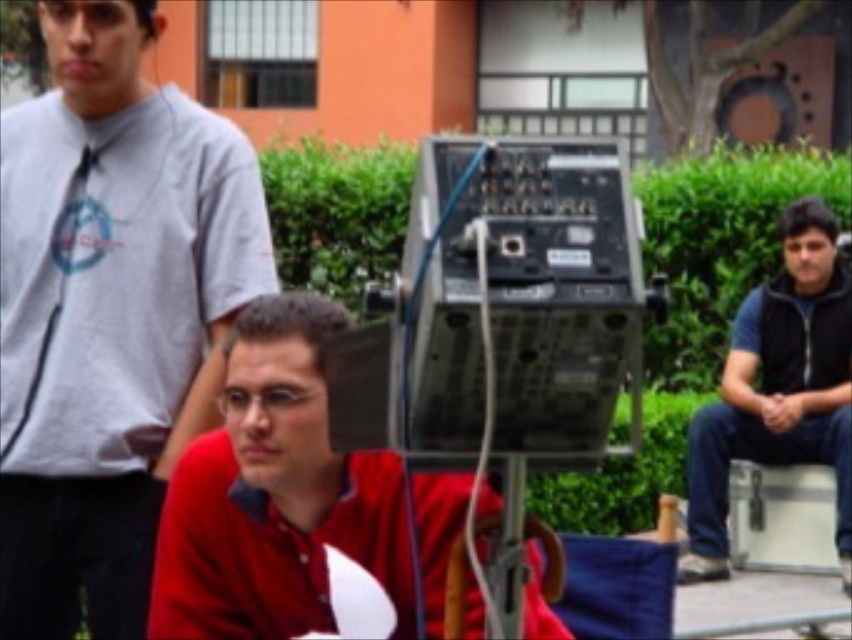
Which is above, matte gray shirt at left or matte red shirt at center?

Positioned higher is matte gray shirt at left.

How far apart are matte gray shirt at left and matte red shirt at center?

A distance of 4.35 feet exists between matte gray shirt at left and matte red shirt at center.

I want to click on matte gray shirt at left, so click(108, 312).

At what (x,y) coordinates should I click in order to perform the action: click on matte gray shirt at left. Please return your answer as a coordinate pair (x, y). Looking at the image, I should click on (108, 312).

Does matte gray shirt at left have a greater height compared to dark blue zip-up jacket at right?

No.

Does matte gray shirt at left have a lesser height compared to dark blue zip-up jacket at right?

Yes.

Between point (240, 138) and point (750, 380), which one is positioned in front?

Point (240, 138) is in front.

The height and width of the screenshot is (640, 852). Identify the location of matte gray shirt at left. (108, 312).

Can you confirm if matte red shirt at center is shorter than dark blue zip-up jacket at right?

Correct, matte red shirt at center is not as tall as dark blue zip-up jacket at right.

In the scene shown: Can you confirm if matte red shirt at center is smaller than dark blue zip-up jacket at right?

Correct, matte red shirt at center occupies less space than dark blue zip-up jacket at right.

Who is more forward, (x=191, y=588) or (x=726, y=499)?

Point (x=191, y=588) is more forward.

I want to click on matte red shirt at center, so click(275, 493).